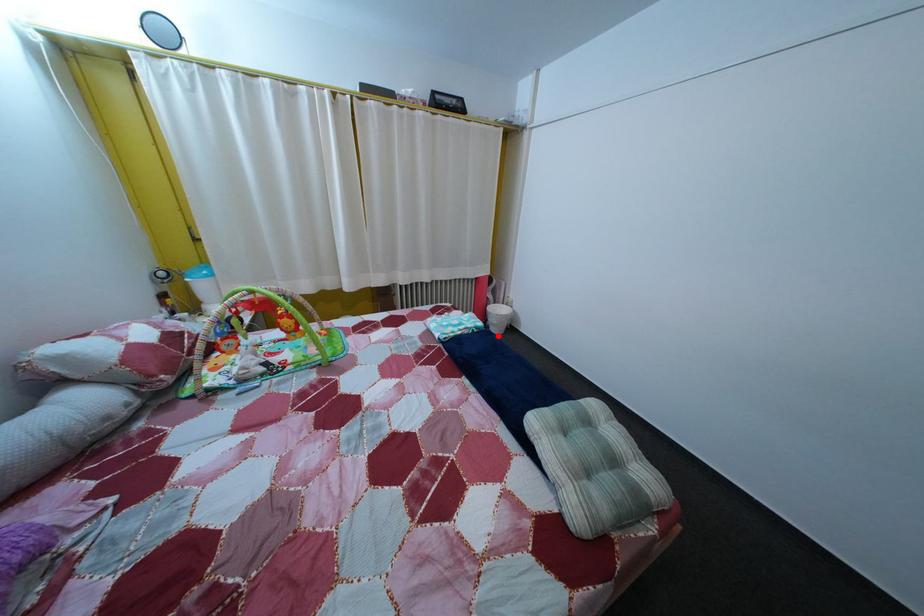
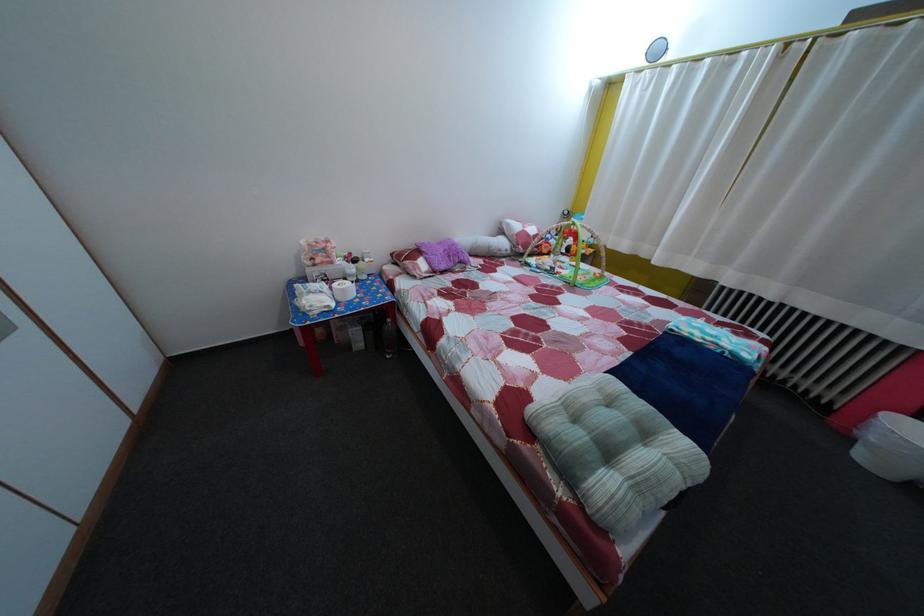
Where in the second image is the point corresponding to the highlighted location from the first image?

(860, 447)